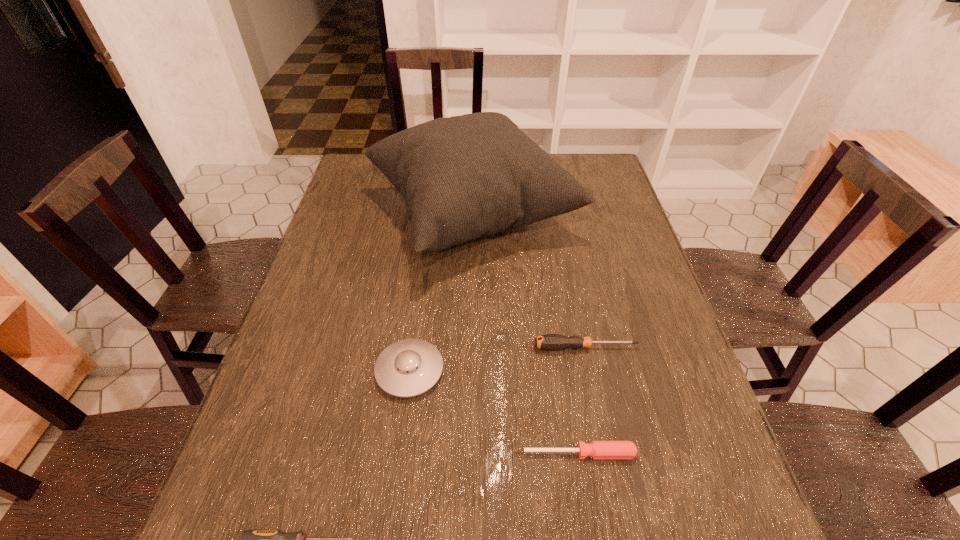
The image size is (960, 540). What are the coordinates of `object that is at the far edge` in the screenshot? It's located at (463, 177).

Locate an element on the screen. Image resolution: width=960 pixels, height=540 pixels. object located at the left edge is located at coordinates (463, 177).

The image size is (960, 540). I want to click on cushion that is at the right edge, so click(x=463, y=177).

The image size is (960, 540). What are the coordinates of `screwdriver present at the right edge` in the screenshot? It's located at (552, 342).

At what (x,y) coordinates should I click in order to perform the action: click on object positioned at the far left corner. Please return your answer as a coordinate pair (x, y). The height and width of the screenshot is (540, 960). Looking at the image, I should click on (463, 177).

You are a GUI agent. You are given a task and a screenshot of the screen. Output one action in this format:
    pyautogui.click(x=<x>, y=<y>)
    Task: Click on the object at the far right corner
    The image size is (960, 540).
    Given the screenshot: What is the action you would take?
    click(463, 177)

The image size is (960, 540). Find the location of `blank space at the left edge of the desktop`. blank space at the left edge of the desktop is located at coordinates (344, 288).

Image resolution: width=960 pixels, height=540 pixels. In the image, there is a desktop. In order to click on vacant space at the right edge in this screenshot , I will do `click(601, 193)`.

The height and width of the screenshot is (540, 960). In the image, there is a desktop. Identify the location of vacant space at the far left corner. point(360,188).

This screenshot has width=960, height=540. What are the coordinates of `free space at the far right corner of the desktop` in the screenshot? It's located at (577, 170).